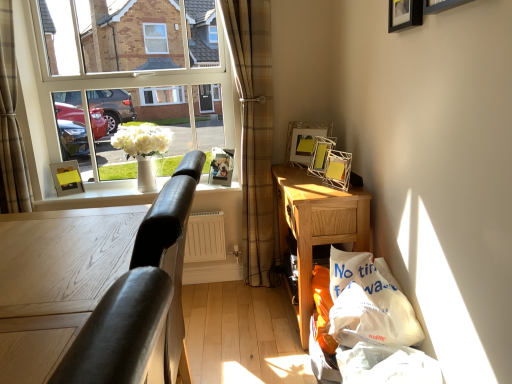
Question: Is brown plaid curtain at left, which appears as the first curtain when viewed from the right, positioned in front of matte yellow picture frame at left, positioned as the second picture frame in back-to-front order?

Choices:
 (A) no
 (B) yes

Answer: (B)

Question: Can you confirm if brown plaid curtain at left, marked as the 2th curtain in a left-to-right arrangement, is thinner than matte yellow picture frame at left, positioned as the second picture frame in back-to-front order?

Choices:
 (A) no
 (B) yes

Answer: (A)

Question: Is brown plaid curtain at left, marked as the 2th curtain in a left-to-right arrangement, bigger than matte yellow picture frame at left, arranged as the fifth picture frame when viewed from the front?

Choices:
 (A) no
 (B) yes

Answer: (B)

Question: Is brown plaid curtain at left, which appears as the first curtain when viewed from the right, completely or partially outside of matte yellow picture frame at left, which appears as the 6th picture frame when viewed from the right?

Choices:
 (A) yes
 (B) no

Answer: (A)

Question: Does brown plaid curtain at left, marked as the 2th curtain in a left-to-right arrangement, contain matte yellow picture frame at left, arranged as the fifth picture frame when viewed from the front?

Choices:
 (A) no
 (B) yes

Answer: (A)

Question: Is white ceramic vase at window taller or shorter than clear glass window at upper left?

Choices:
 (A) tall
 (B) short

Answer: (B)

Question: Is white ceramic vase at window bigger or smaller than clear glass window at upper left?

Choices:
 (A) big
 (B) small

Answer: (B)

Question: Relative to clear glass window at upper left, is white ceramic vase at window in front or behind?

Choices:
 (A) behind
 (B) front

Answer: (B)

Question: Is white ceramic vase at window to the left or to the right of clear glass window at upper left in the image?

Choices:
 (A) right
 (B) left

Answer: (A)

Question: Based on their positions, is white ceramic vase at window located to the left or right of plaid fabric curtain at left, the 1th curtain in the left-to-right sequence?

Choices:
 (A) left
 (B) right

Answer: (B)

Question: Do you think white ceramic vase at window is within plaid fabric curtain at left, the 1th curtain in the left-to-right sequence, or outside of it?

Choices:
 (A) outside
 (B) inside

Answer: (A)

Question: In terms of width, does white ceramic vase at window look wider or thinner when compared to plaid fabric curtain at left, the 2th curtain viewed from the right?

Choices:
 (A) thin
 (B) wide

Answer: (B)

Question: Is point (138, 180) closer or farther from the camera than point (6, 1)?

Choices:
 (A) closer
 (B) farther

Answer: (B)

Question: Is black leather table at left in front of or behind matte yellow picture frame at left, arranged as the fifth picture frame when viewed from the front, in the image?

Choices:
 (A) behind
 (B) front

Answer: (B)

Question: Is black leather table at left wider or thinner than matte yellow picture frame at left, which appears as the 6th picture frame when viewed from the right?

Choices:
 (A) wide
 (B) thin

Answer: (A)